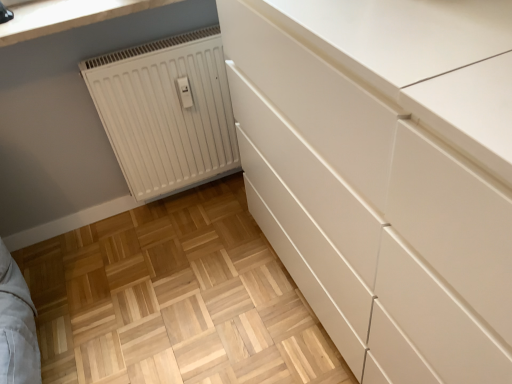
Question: Is the surface of white matte radiator at lower left in direct contact with white smooth countertop at upper left?

Choices:
 (A) yes
 (B) no

Answer: (B)

Question: Does white matte radiator at lower left appear on the left side of white smooth countertop at upper left?

Choices:
 (A) yes
 (B) no

Answer: (B)

Question: From a real-world perspective, is white matte radiator at lower left on white smooth countertop at upper left?

Choices:
 (A) yes
 (B) no

Answer: (B)

Question: Is white matte radiator at lower left outside white smooth countertop at upper left?

Choices:
 (A) yes
 (B) no

Answer: (A)

Question: From the image's perspective, would you say white matte radiator at lower left is shown under white smooth countertop at upper left?

Choices:
 (A) yes
 (B) no

Answer: (A)

Question: From a real-world perspective, is white matte radiator at lower left below white smooth countertop at upper left?

Choices:
 (A) yes
 (B) no

Answer: (A)

Question: Is white smooth countertop at upper left positioned behind white matte radiator at lower left?

Choices:
 (A) yes
 (B) no

Answer: (B)

Question: Would you consider white smooth countertop at upper left to be distant from white matte radiator at lower left?

Choices:
 (A) yes
 (B) no

Answer: (B)

Question: Does white smooth countertop at upper left have a greater width compared to white matte radiator at lower left?

Choices:
 (A) no
 (B) yes

Answer: (B)

Question: Can you confirm if white smooth countertop at upper left is positioned to the left of white matte radiator at lower left?

Choices:
 (A) no
 (B) yes

Answer: (B)

Question: Is white smooth countertop at upper left aimed at white matte radiator at lower left?

Choices:
 (A) yes
 (B) no

Answer: (B)

Question: Is white smooth countertop at upper left looking in the opposite direction of white matte radiator at lower left?

Choices:
 (A) no
 (B) yes

Answer: (A)

Question: Considering the positions of white matte radiator at lower left and white smooth countertop at upper left in the image, is white matte radiator at lower left bigger or smaller than white smooth countertop at upper left?

Choices:
 (A) big
 (B) small

Answer: (A)